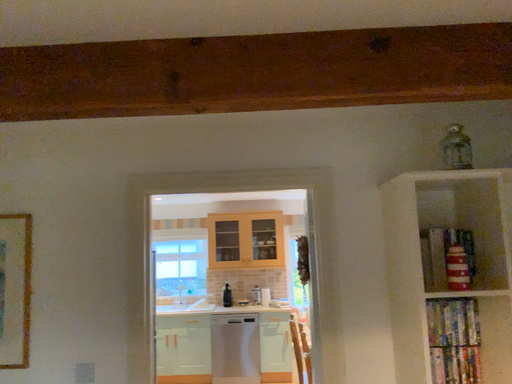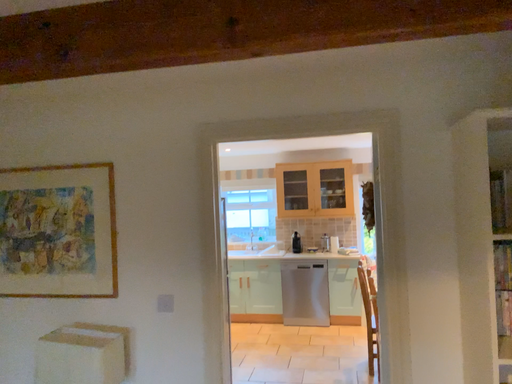
Question: How did the camera likely rotate when shooting the video?

Choices:
 (A) rotated upward
 (B) rotated downward

Answer: (B)